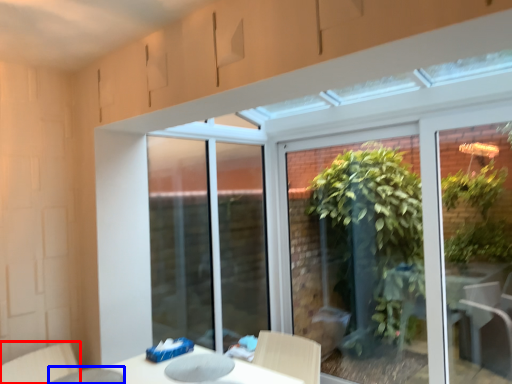
Question: Which of the following is the closest to the observer, swivel chair (highlighted by a red box) or glass table (highlighted by a blue box)?

Choices:
 (A) swivel chair
 (B) glass table

Answer: (B)